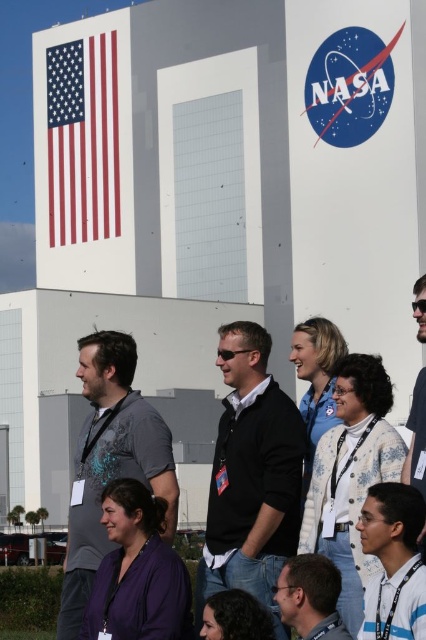
Question: Does black matte jacket at center appear over gray t-shirt at center?

Choices:
 (A) no
 (B) yes

Answer: (B)

Question: Does gray t-shirt at center appear over matte black shirt at center?

Choices:
 (A) no
 (B) yes

Answer: (A)

Question: Does black matte jacket at center come in front of matte black shirt at center?

Choices:
 (A) yes
 (B) no

Answer: (B)

Question: Considering the real-world distances, which object is closest to the dark gray shirt at center?

Choices:
 (A) black matte jacket at center
 (B) gray t-shirt at center
 (C) red-white-and-blue fabric flag at upper left

Answer: (A)

Question: Which of the following is the farthest from the observer?

Choices:
 (A) (238, 573)
 (B) (420, 314)
 (C) (83, 80)
 (D) (314, 557)

Answer: (C)

Question: Which is nearer to the black matte jacket at center?

Choices:
 (A) red-white-and-blue fabric flag at upper left
 (B) matte black shirt at center
 (C) gray t-shirt at center

Answer: (B)